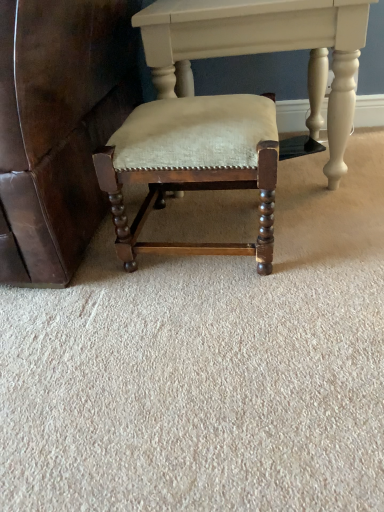
Describe the element at coordinates (193, 166) in the screenshot. I see `matte wood chair at center` at that location.

Locate an element on the screen. The height and width of the screenshot is (512, 384). matte wood chair at center is located at coordinates (193, 166).

Identify the location of matte white table at center. This screenshot has height=512, width=384. (261, 48).

What is the approximate width of matte white table at center?

20.06 inches.

Image resolution: width=384 pixels, height=512 pixels. Describe the element at coordinates (261, 48) in the screenshot. I see `matte white table at center` at that location.

At what (x,y) coordinates should I click in order to perform the action: click on matte wood chair at center. Please return your answer as a coordinate pair (x, y). This screenshot has height=512, width=384. Looking at the image, I should click on (193, 166).

Based on the photo, which is more to the left, matte white table at center or matte wood chair at center?

Positioned to the left is matte wood chair at center.

Which is in front, matte white table at center or matte wood chair at center?

matte wood chair at center is more forward.

Does point (335, 88) come farther from viewer compared to point (246, 112)?

Yes.

From the image's perspective, is matte white table at center located above or below matte wood chair at center?

Based on their image positions, matte white table at center is located above matte wood chair at center.

From a real-world perspective, who is located higher, matte white table at center or matte wood chair at center?

matte white table at center, from a real-world perspective.

Does matte white table at center have a greater width compared to matte wood chair at center?

Yes.

Between matte white table at center and matte wood chair at center, which one has more height?

With more height is matte white table at center.

Considering the relative sizes of matte white table at center and matte wood chair at center in the image provided, is matte white table at center smaller than matte wood chair at center?

Actually, matte white table at center might be larger than matte wood chair at center.

Is matte white table at center inside or outside of matte wood chair at center?

matte white table at center lies outside matte wood chair at center.

Are matte white table at center and matte wood chair at center far apart?

matte white table at center is actually quite close to matte wood chair at center.

In the scene shown: Is matte white table at center oriented towards matte wood chair at center?

Yes, matte white table at center faces towards matte wood chair at center.

How many degrees apart are the facing directions of matte white table at center and matte wood chair at center?

There is a 1.68-degree angle between the facing directions of matte white table at center and matte wood chair at center.

This screenshot has height=512, width=384. Find the location of `chair below the matte white table at center (from a real-world perspective)`. chair below the matte white table at center (from a real-world perspective) is located at coordinates (193, 166).

Considering the positions of objects matte wood chair at center and matte white table at center in the image provided, who is more to the left, matte wood chair at center or matte white table at center?

matte wood chair at center.

Is the depth of matte wood chair at center less than that of matte white table at center?

Yes, matte wood chair at center is closer to the viewer.

Which is behind, point (112, 186) or point (356, 6)?

The point (356, 6) is more distant.

From the image's perspective, is matte wood chair at center positioned above or below matte white table at center?

matte wood chair at center is below matte white table at center.

From a real-world perspective, which is physically below, matte wood chair at center or matte white table at center?

In real-world perspective, matte wood chair at center is lower.

Is matte wood chair at center thinner than matte white table at center?

Indeed, matte wood chair at center has a lesser width compared to matte white table at center.

Considering the relative sizes of matte wood chair at center and matte white table at center in the image provided, is matte wood chair at center shorter than matte white table at center?

A: Correct, matte wood chair at center is not as tall as matte white table at center.

Does matte wood chair at center have a smaller size compared to matte white table at center?

Indeed, matte wood chair at center has a smaller size compared to matte white table at center.

Is matte white table at center surrounded by matte wood chair at center?

Definitely not — matte white table at center is not inside matte wood chair at center.

Is matte wood chair at center beside matte white table at center?

matte wood chair at center and matte white table at center are not in contact.

Is matte wood chair at center positioned with its back to matte white table at center?

Absolutely, matte wood chair at center is directed away from matte white table at center.

How different are the orientations of matte wood chair at center and matte white table at center in degrees?

There is a 1.68-degree angle between the facing directions of matte wood chair at center and matte white table at center.

The image size is (384, 512). Identify the location of table that appears above the matte wood chair at center (from a real-world perspective). (261, 48).

Image resolution: width=384 pixels, height=512 pixels. In order to click on table on the right of the matte wood chair at center in this screenshot , I will do `click(261, 48)`.

You are a GUI agent. You are given a task and a screenshot of the screen. Output one action in this format:
    pyautogui.click(x=<x>, y=<y>)
    Task: Click on the chair that is in front of the matte white table at center
    Image resolution: width=384 pixels, height=512 pixels.
    Given the screenshot: What is the action you would take?
    pyautogui.click(x=193, y=166)